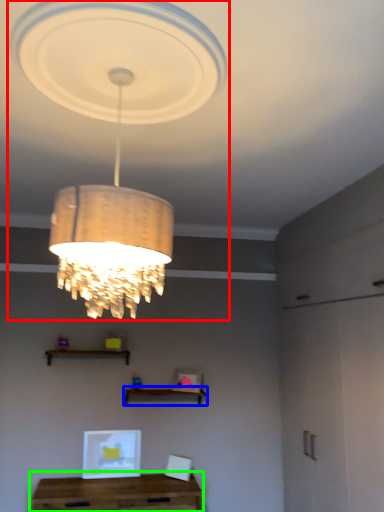
Question: Which object is the farthest from lamp (highlighted by a red box)? Choose among these: shelf (highlighted by a blue box) or table (highlighted by a green box).

Choices:
 (A) shelf
 (B) table

Answer: (B)